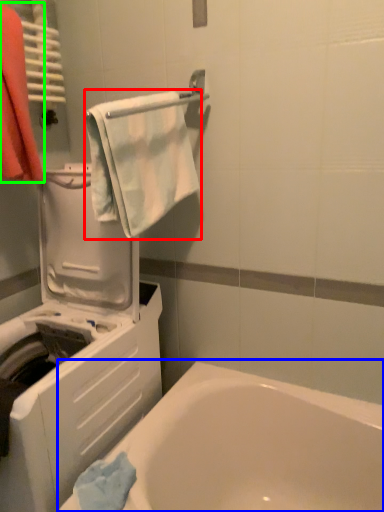
Question: Estimate the real-world distances between objects in this image. Which object is closer to towel/napkin (highlighted by a red box), bathtub (highlighted by a blue box) or laundry (highlighted by a green box)?

Choices:
 (A) bathtub
 (B) laundry

Answer: (B)